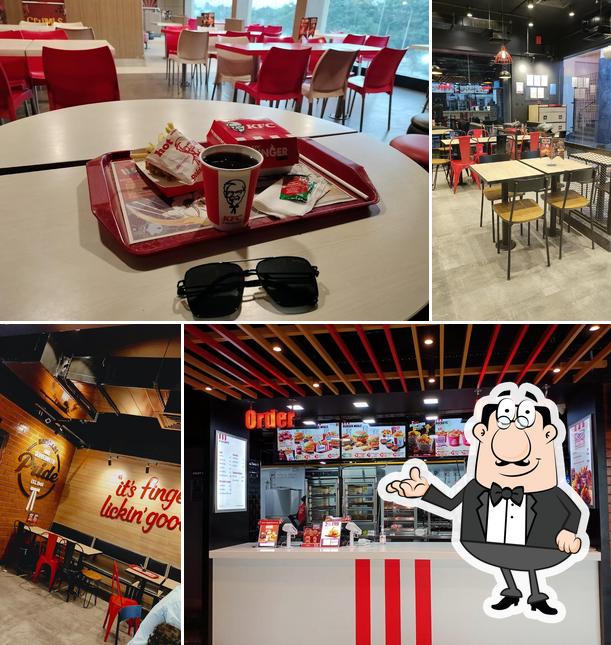
You are a GUI agent. You are given a task and a screenshot of the screen. Output one action in this format:
    pyautogui.click(x=<x>, y=<y>)
    Task: Click on the tables
    The height and width of the screenshot is (645, 611).
    Given the screenshot: What is the action you would take?
    pyautogui.click(x=500, y=175), pyautogui.click(x=552, y=168), pyautogui.click(x=597, y=157), pyautogui.click(x=480, y=139), pyautogui.click(x=525, y=135), pyautogui.click(x=437, y=133), pyautogui.click(x=88, y=550), pyautogui.click(x=167, y=584), pyautogui.click(x=159, y=580)